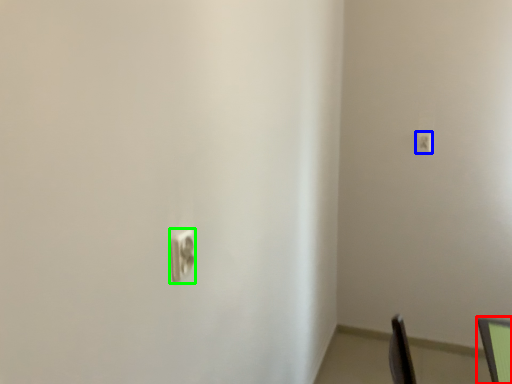
Question: Estimate the real-world distances between objects in this image. Which object is farther from computer monitor (highlighted by a red box), light switch (highlighted by a blue box) or light switch (highlighted by a green box)?

Choices:
 (A) light switch
 (B) light switch

Answer: (A)